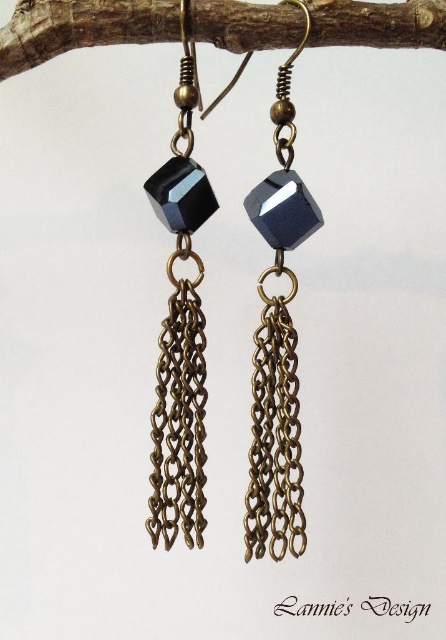
You are an interior designer arranging items on a shelf. You have the brown wood at upper center and the sapphire glass cube at center. According to the image, which object is positioned to the left of the other?

The brown wood at upper center is to the left of the sapphire glass cube at center.

You are an interior designer arranging furniture in a living room. You have a brown wood at upper center and a sapphire glass cube at center. According to the scene description, which object is placed higher in the room?

The brown wood at upper center is positioned over the sapphire glass cube at center, so it is placed higher in the room.